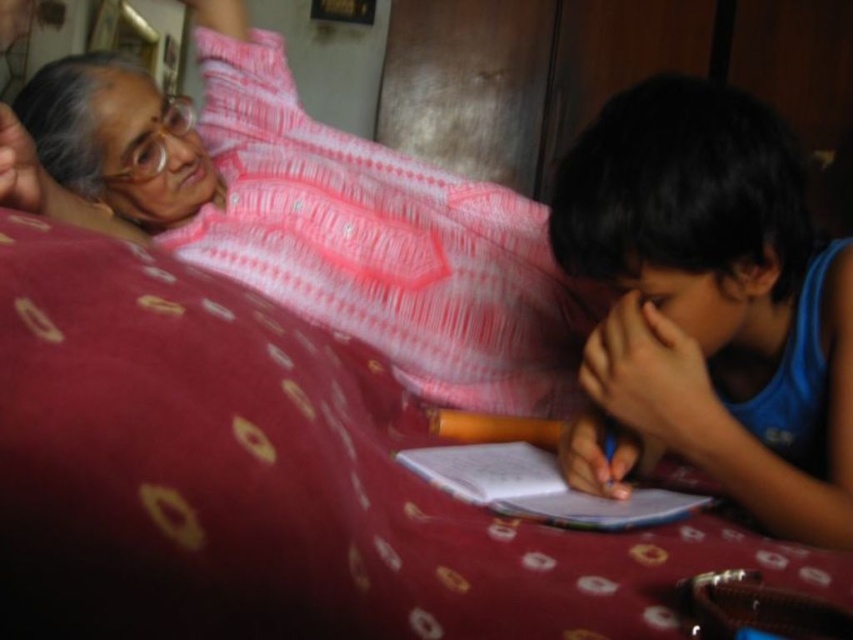
Who is more distant from viewer, (207, 280) or (848, 416)?

The point (848, 416) is more distant.

Does patterned fabric bed at center have a smaller size compared to blue cotton shirt at right?

Incorrect, patterned fabric bed at center is not smaller in size than blue cotton shirt at right.

Which is behind, point (132, 540) or point (563, 237)?

The point (563, 237) is behind.

You are a GUI agent. You are given a task and a screenshot of the screen. Output one action in this format:
    pyautogui.click(x=<x>, y=<y>)
    Task: Click on the patterned fabric bed at center
    This screenshot has height=640, width=853.
    Given the screenshot: What is the action you would take?
    pyautogui.click(x=273, y=481)

Does patterned fabric bed at center appear on the left side of pink textured kurta at upper left?

In fact, patterned fabric bed at center is to the right of pink textured kurta at upper left.

Is point (512, 582) positioned before point (339, 192)?

Yes, point (512, 582) is closer to viewer.

Identify the location of patterned fabric bed at center. This screenshot has width=853, height=640. (273, 481).

Between pink textured kurta at upper left and blue cotton shirt at right, which one has less height?

With less height is blue cotton shirt at right.

Between point (113, 176) and point (741, 259), which one is positioned in front?

Positioned in front is point (741, 259).

Locate an element on the screen. Image resolution: width=853 pixels, height=640 pixels. pink textured kurta at upper left is located at coordinates (306, 216).